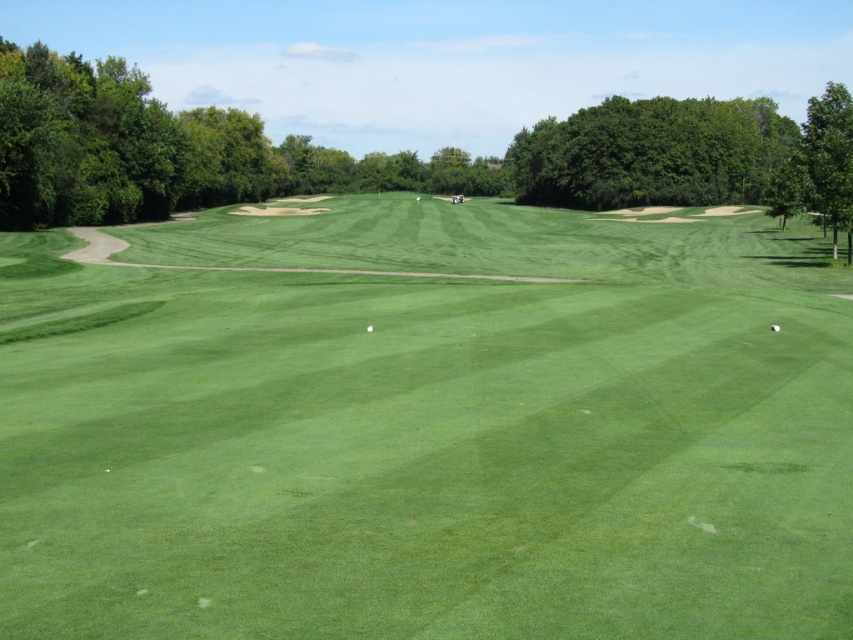
You are a golfer standing at the tee and see the green leafy tree at right and the green smooth golf ball at lower right. Which object is higher in the image?

The green leafy tree at right is above the green smooth golf ball at lower right, so the green leafy tree at right is higher in the image.

You are a golfer standing at the green smooth golf ball at lower right. You want to hit the ball towards the green leafy tree at right. Is the tree within a 100 meter range?

The distance between the green leafy tree at right and the green smooth golf ball at lower right is 98.51 meters, which is within the 100 meter range. Therefore, the tree is within the desired distance.

You are a golfer standing at the tee box preparing to hit your first shot. You notice a point marked at coordinates (427, 428) on your map. Based on the scene description, what type of terrain will you encounter at that point?

The point marked at coordinates (427, 428) corresponds to the green grassy field at center, which is a flat and open area suitable for a golf shot.